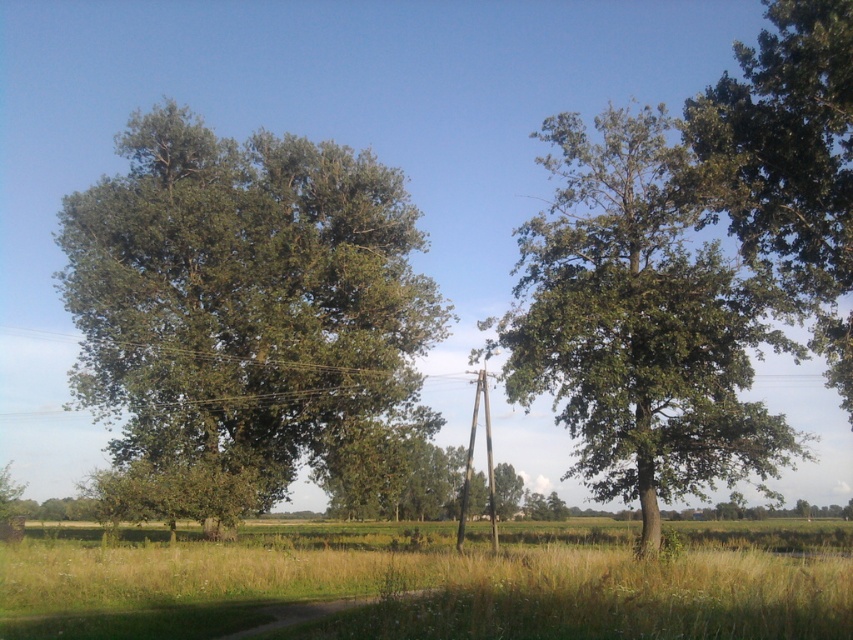
You are standing at the center of the dirt path in the rural landscape. You want to walk towards the green leafy tree at right. Which direction should you face to head directly towards it?

The green leafy tree at right is located at point 0.503 on the x axis and 0.751 on the y axis. Since the coordinates are relative to the image, facing towards the right side of the image would direct you towards the green leafy tree at right.

You are planning to plant a new tree between the green leafy tree at left and the green leafy tree at right along the dirt path. Considering their sizes, which existing tree should you use as a reference to ensure the new tree has enough space to grow without overcrowding?

The green leafy tree at left is taller than the green leafy tree at right, so you should use the green leafy tree at left as a reference to ensure the new tree has enough space to grow without overcrowding.